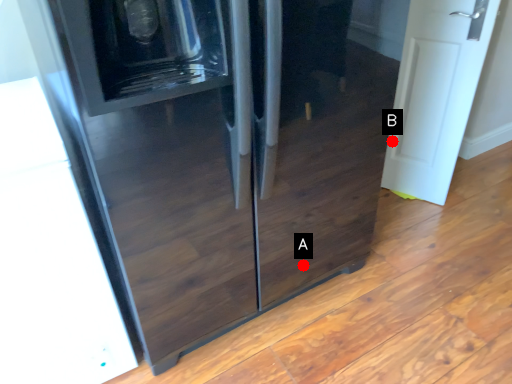
Question: Two points are circled on the image, labeled by A and B beside each circle. Which point is closer to the camera?

Choices:
 (A) A is closer
 (B) B is closer

Answer: (A)